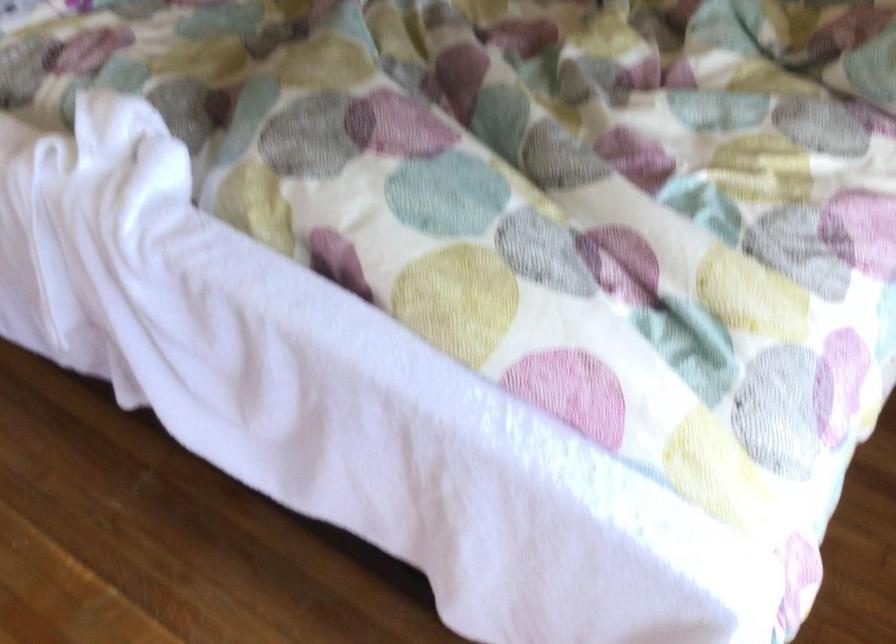
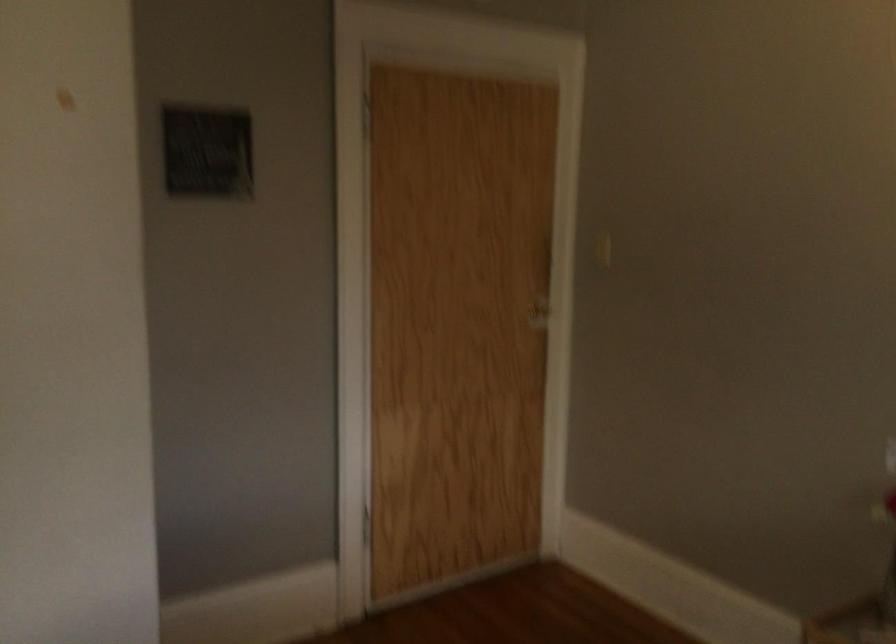
First-person continuous shooting, in which direction is the camera rotating?

The camera rotated toward left-up.